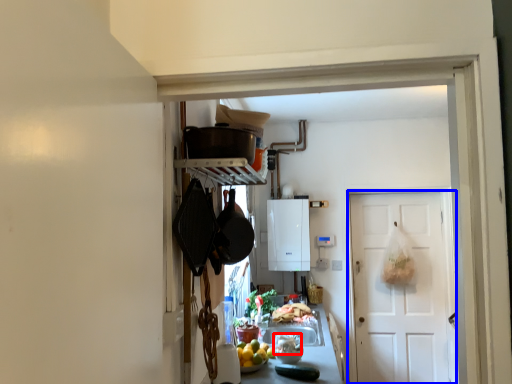
Question: Among these objects, which one is farthest to the camera, food (highlighted by a red box) or door (highlighted by a blue box)?

Choices:
 (A) food
 (B) door

Answer: (B)